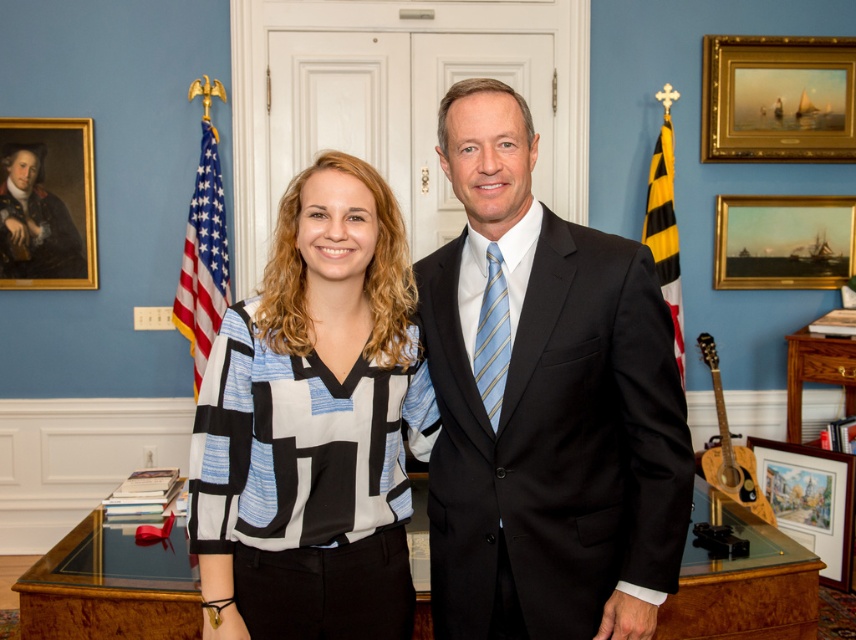
Which is below, oil painting portrait at upper left or red-white-blue fabric flag at left?

red-white-blue fabric flag at left

Looking at this image, can you confirm if oil painting portrait at upper left is positioned to the left of red-white-blue fabric flag at left?

Yes, oil painting portrait at upper left is to the left of red-white-blue fabric flag at left.

Image resolution: width=856 pixels, height=640 pixels. I want to click on oil painting portrait at upper left, so click(x=46, y=204).

The width and height of the screenshot is (856, 640). In order to click on oil painting portrait at upper left in this screenshot , I will do `click(46, 204)`.

In the scene shown: Is black wool suit at center thinner than gold-framed painting at upper right?

Indeed, black wool suit at center has a lesser width compared to gold-framed painting at upper right.

Between black wool suit at center and gold-framed painting at upper right, which one has less height?

With less height is gold-framed painting at upper right.

Who is more forward, (559, 272) or (768, 284)?

Positioned in front is point (559, 272).

Locate an element on the screen. The width and height of the screenshot is (856, 640). black wool suit at center is located at coordinates (553, 432).

Is matte black and white blouse at center closer to camera compared to gold-framed painting at upper right?

That is True.

Can you confirm if matte black and white blouse at center is smaller than gold-framed painting at upper right?

No.

The height and width of the screenshot is (640, 856). In order to click on matte black and white blouse at center in this screenshot , I will do `click(313, 424)`.